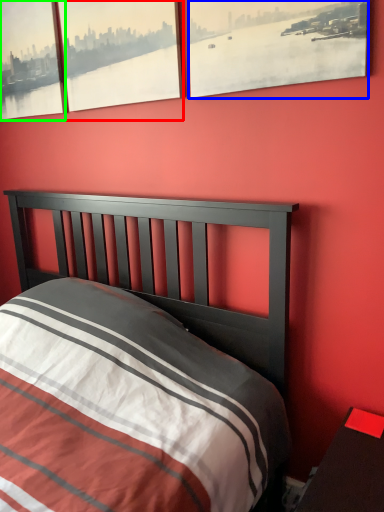
Question: Considering the real-world distances, which object is closest to window (highlighted by a red box)? window (highlighted by a blue box) or window (highlighted by a green box).

Choices:
 (A) window
 (B) window

Answer: (B)